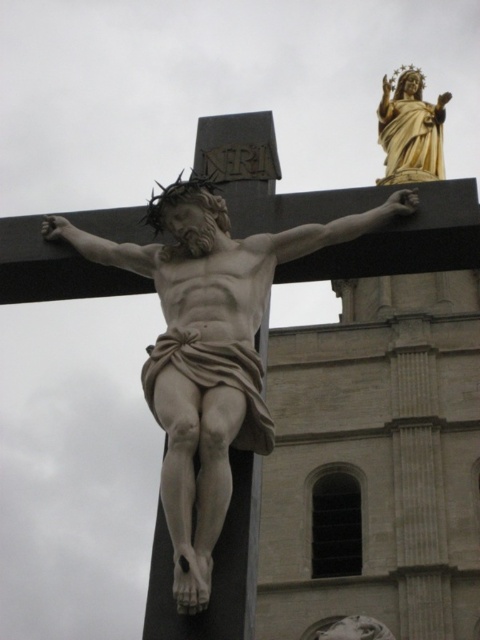
Can you confirm if white marble statue at center is positioned below gold polished statue at upper right?

Correct, white marble statue at center is located below gold polished statue at upper right.

You are a GUI agent. You are given a task and a screenshot of the screen. Output one action in this format:
    pyautogui.click(x=<x>, y=<y>)
    Task: Click on the white marble statue at center
    
    Given the screenshot: What is the action you would take?
    pyautogui.click(x=210, y=348)

Does gold polished statue at upper right have a lesser height compared to smooth white statue at center?

In fact, gold polished statue at upper right may be taller than smooth white statue at center.

Between point (397, 138) and point (370, 637), which one is positioned in front?

Point (370, 637) is in front.

This screenshot has width=480, height=640. I want to click on gold polished statue at upper right, so click(x=409, y=129).

The image size is (480, 640). Identify the location of gold polished statue at upper right. tap(409, 129).

How far apart are white marble statue at center and smooth white statue at center?

They are 105.72 feet apart.

Is white marble statue at center to the right of smooth white statue at center from the viewer's perspective?

Incorrect, white marble statue at center is not on the right side of smooth white statue at center.

Between point (157, 413) and point (324, 625), which one is positioned in front?

Point (157, 413)

The height and width of the screenshot is (640, 480). What are the coordinates of `white marble statue at center` in the screenshot? It's located at (210, 348).